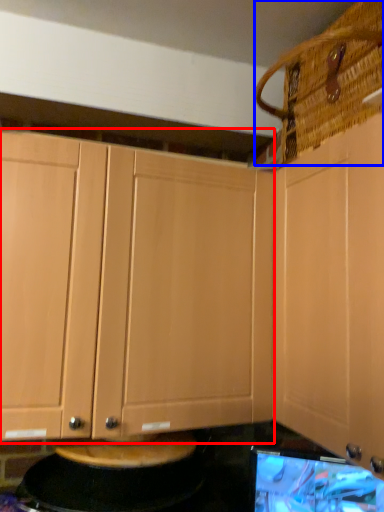
Question: Which point is further to the camera, cabinetry (highlighted by a red box) or basket (highlighted by a blue box)?

Choices:
 (A) cabinetry
 (B) basket

Answer: (A)